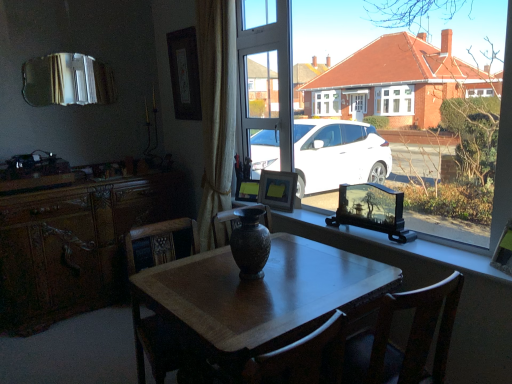
This screenshot has width=512, height=384. What are the coordinates of `free point in front of matte brown vase at center` in the screenshot? It's located at (248, 289).